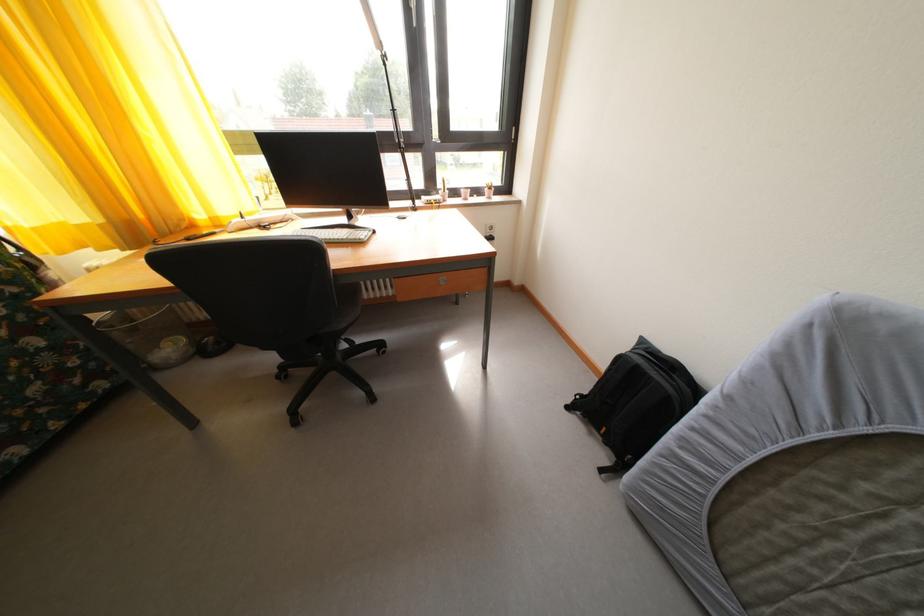
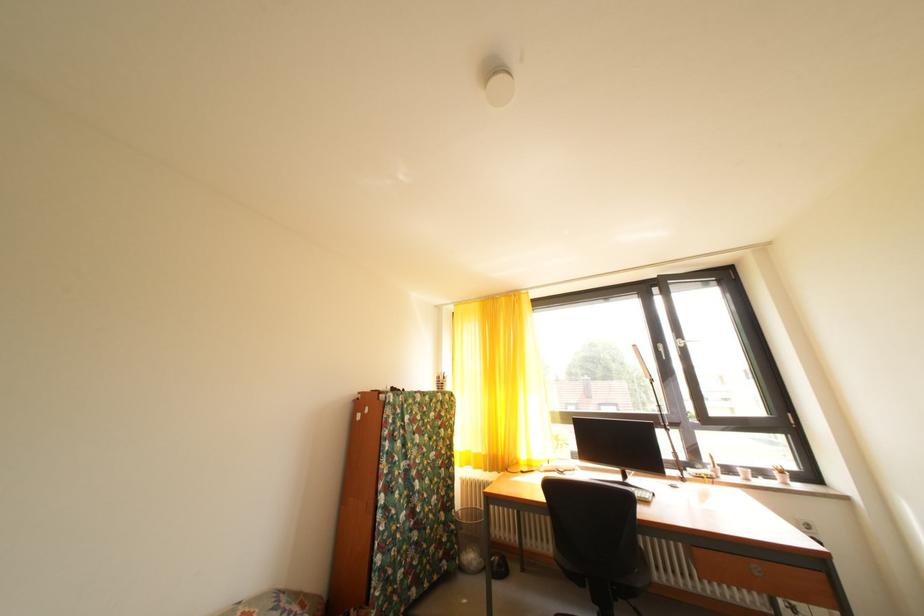
The images are taken continuously from a first-person perspective. In which direction is your viewpoint rotating?

The camera rotated toward left-up.